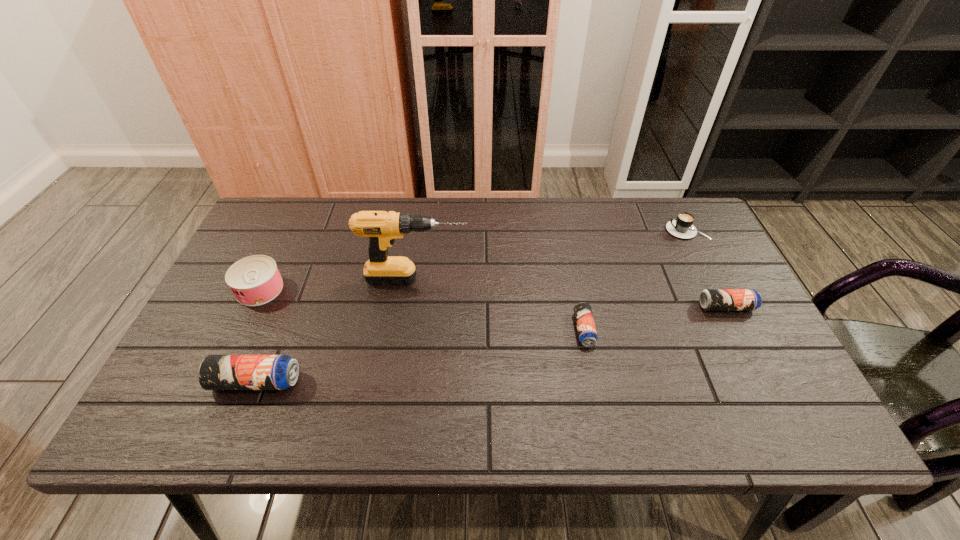
Image resolution: width=960 pixels, height=540 pixels. In order to click on the nearest beer can in this screenshot , I will do `click(216, 372)`.

Image resolution: width=960 pixels, height=540 pixels. I want to click on the nearest object, so 216,372.

In order to click on the second beer can from left to right in this screenshot , I will do `click(586, 329)`.

Where is `the shortest object`? the shortest object is located at coordinates coord(586,329).

Find the location of a particular element. The height and width of the screenshot is (540, 960). the rightmost beer can is located at coordinates pyautogui.click(x=710, y=299).

Where is `can`? can is located at coordinates (255, 280).

Image resolution: width=960 pixels, height=540 pixels. I want to click on the farthest object, so click(682, 226).

At what (x,y) coordinates should I click in order to perform the action: click on drill. Please return your answer as a coordinate pair (x, y). This screenshot has width=960, height=540. Looking at the image, I should click on click(x=382, y=228).

Identify the location of the tallest object. This screenshot has height=540, width=960. (382, 228).

Image resolution: width=960 pixels, height=540 pixels. Find the location of `vacant space situated on the right of the tallest beer can`. vacant space situated on the right of the tallest beer can is located at coordinates (392, 381).